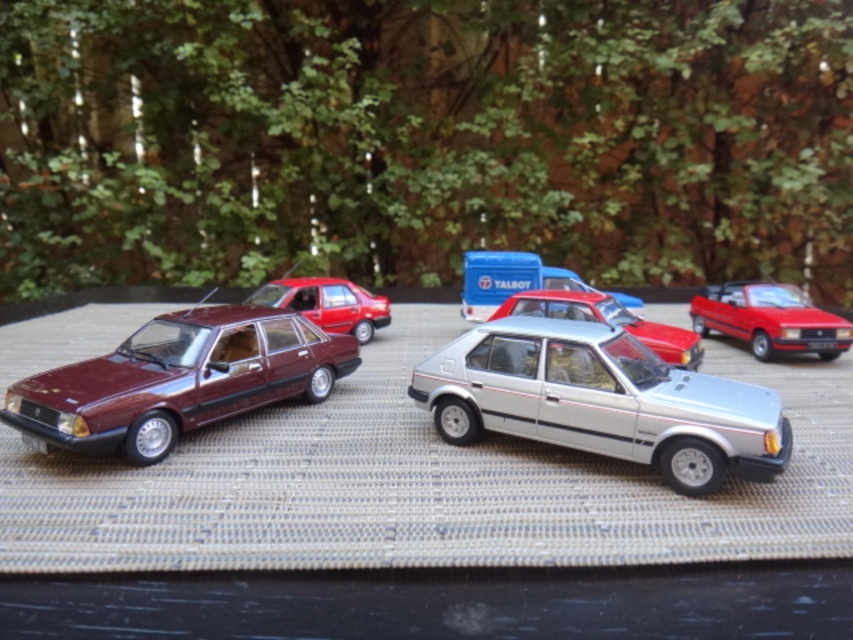
You are standing in front of a display table with miniature model cars. You notice a point marked at coordinates (250, 360). If you want to reach this point without moving your feet, can you touch it with your outstretched hand?

→ The point at (250, 360) is 5.61 feet away from the camera, so it is too far to reach with an outstretched hand.

You are a curator arranging miniature cars on a display table. You have a silver sedan and a maroon metallic sedan. You need to place a small label at point (178, 380). Which car should the label be placed near?

The label at point (178, 380) should be placed near the maroon metallic sedan at left because the Objects Description states that this point corresponds to that car.

You are arranging miniature model cars on a display table. You have a silver metallic hatchback at center and a glossy red sedan at center. If you want to place a new model between them, where should you position it?

The silver metallic hatchback at center is positioned on the right side of the glossy red sedan at center, so you should place the new model between them to the left of the silver metallic hatchback at center and to the right of the glossy red sedan at center.